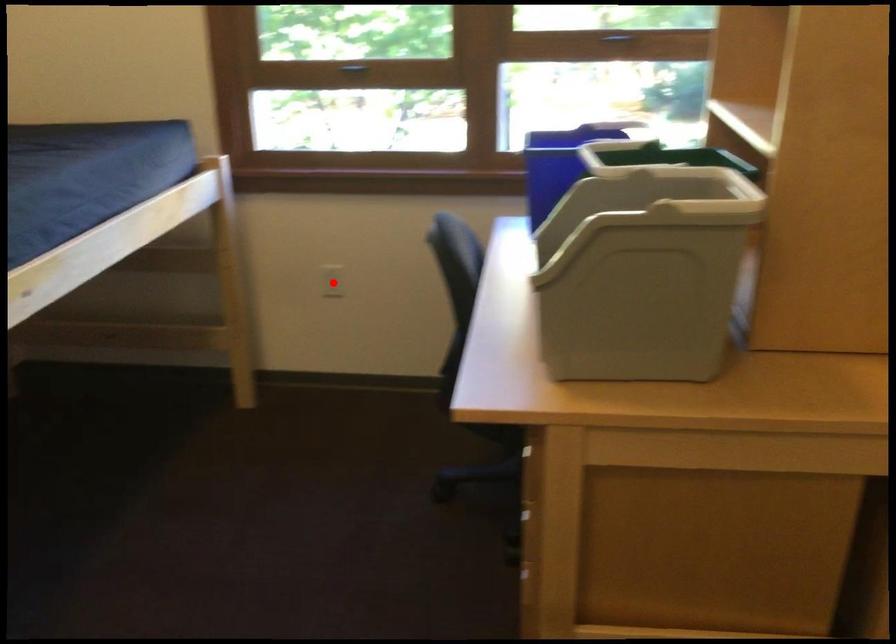
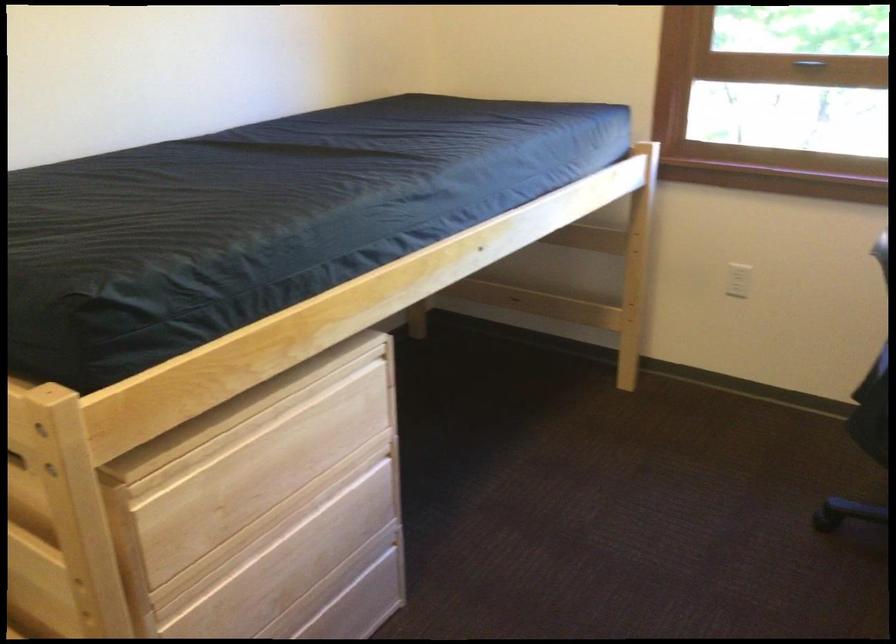
Where in the second image is the point corresponding to the highlighted location from the first image?

(738, 279)